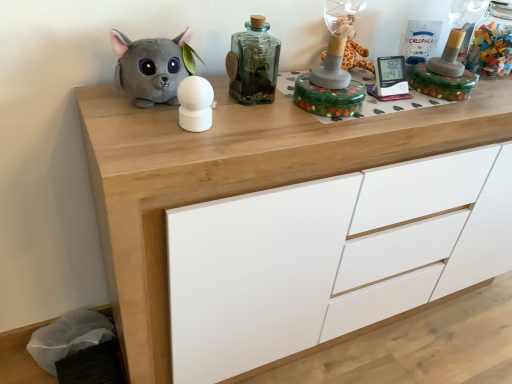
Find the location of a particular element. This screenshot has width=512, height=384. free area in between white matte sphere at center, which is the 2th toy from right to left, and green floral box at center, acting as the 1th toy starting from the right is located at coordinates (264, 115).